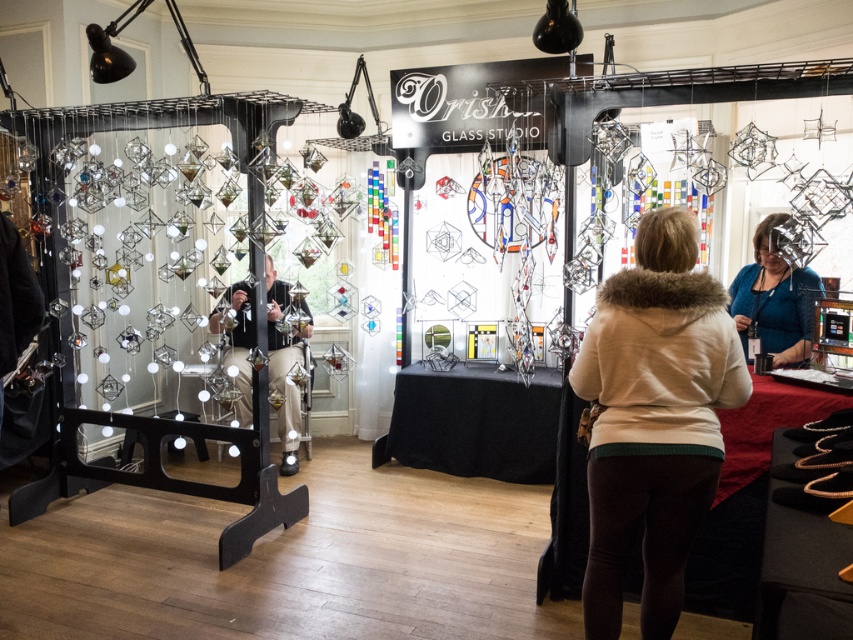
Does point (728, 339) lie in front of point (764, 284)?

Yes, it is in front of point (764, 284).

Is beige fur coat at center wider than matte glass ornament at right?

Correct, the width of beige fur coat at center exceeds that of matte glass ornament at right.

Is point (619, 291) behind point (755, 298)?

No, it is in front of (755, 298).

Image resolution: width=853 pixels, height=640 pixels. Identify the location of beige fur coat at center. (653, 419).

In the scene shown: Who is more distant from viewer, (x=741, y=328) or (x=267, y=348)?

The point (x=267, y=348) is more distant.

Does matte glass ornament at right appear on the left side of matte black camera at center?

Incorrect, matte glass ornament at right is not on the left side of matte black camera at center.

Is point (778, 355) positioned behind point (236, 307)?

That is False.

Where is `matte glass ornament at right`? This screenshot has width=853, height=640. matte glass ornament at right is located at coordinates (775, 298).

Who is more distant from viewer, (627, 346) or (293, 458)?

The point (293, 458) is behind.

Can you confirm if beige fur coat at center is smaller than matte black camera at center?

Yes.

The image size is (853, 640). What do you see at coordinates (653, 419) in the screenshot?
I see `beige fur coat at center` at bounding box center [653, 419].

Identify the location of beige fur coat at center. (653, 419).